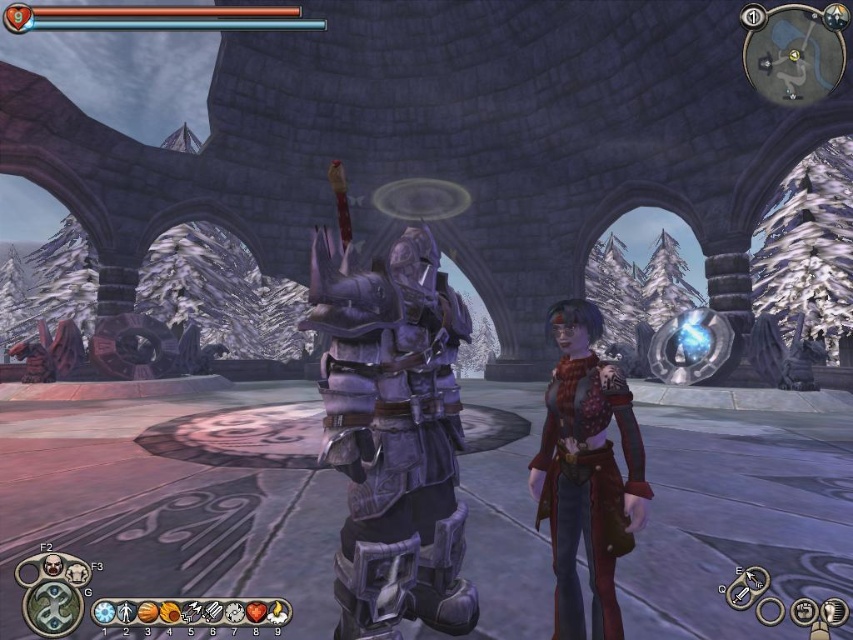
Question: Considering the relative positions of polished purple armor at center and red leather jacket at center in the image provided, where is polished purple armor at center located with respect to red leather jacket at center?

Choices:
 (A) above
 (B) below

Answer: (A)

Question: Among these points, which one is nearest to the camera?

Choices:
 (A) (415, 564)
 (B) (575, 392)

Answer: (A)

Question: Among these points, which one is farthest from the camera?

Choices:
 (A) (584, 536)
 (B) (332, 321)

Answer: (A)

Question: Observing the image, what is the correct spatial positioning of polished purple armor at center in reference to red leather jacket at center?

Choices:
 (A) above
 (B) below

Answer: (A)

Question: Where is polished purple armor at center located in relation to red leather jacket at center in the image?

Choices:
 (A) above
 (B) below

Answer: (A)